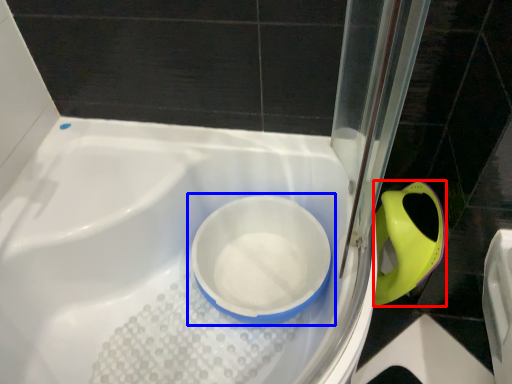
Question: Which point is closer to the camera, bidet (highlighted by a red box) or toilet (highlighted by a blue box)?

Choices:
 (A) bidet
 (B) toilet

Answer: (B)